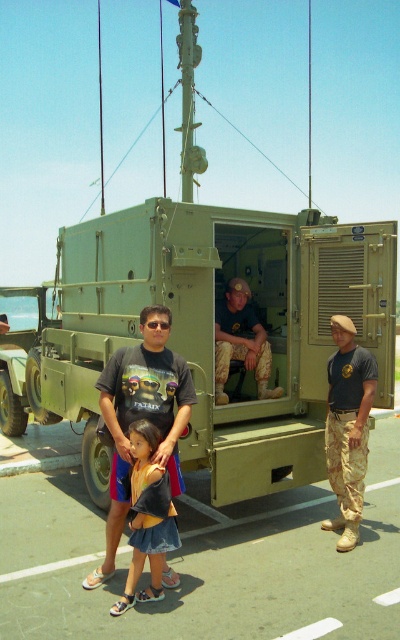
You are a photographer standing at the front of the military truck. You want to take a photo of the denim skirt at lower center. Where should you aim your camera to capture it?

You should aim your camera at point (148, 516) to capture the denim skirt at lower center.

You are a photographer standing at a safe distance from the matte green military truck at left. You want to take a photo of the truck without including any people in the frame. Considering the truck is 6.80 meters away from you, is it possible to frame the shot so that the truck fills the image while excluding the people in front of it?

The matte green military truck at left is 6.80 meters away from the camera. Since the truck is positioned at a distance and the people are in front of it, you can adjust your camera angle or zoom to focus solely on the truck while excluding the people in front, as they are closer to the camera than the truck. However, this depends on the camera lens capabilities and the exact positioning of the people.